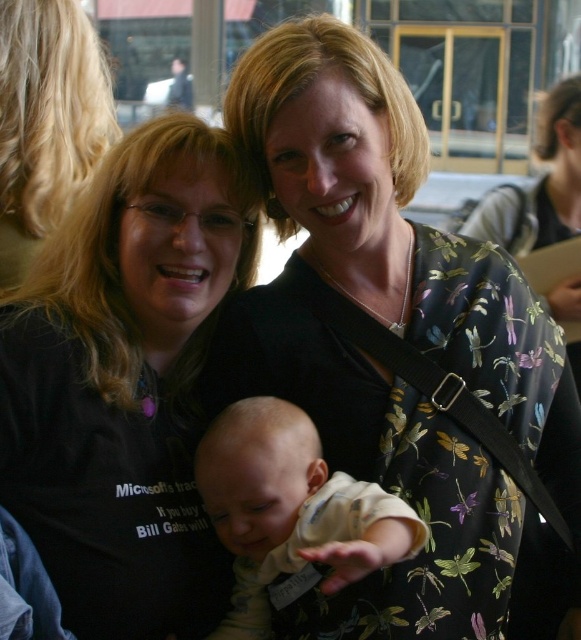
You are a photographer trying to capture a closeup of the baby while ensuring the text on the black matte shirt at left is still visible in the background. Is the light beige soft fabric baby at center positioned in a way that allows both elements to be in focus?

The light beige soft fabric baby at center is behind the black matte shirt at left, so the baby is closer to the camera than the shirt. This means the baby will be in focus, but the shirt might be slightly out of focus. To capture both clearly, adjust the focus to include both distances or use a smaller aperture for a deeper depth of field.

You are standing at a distance of 35 feet from the camera and want to reach the point marked as point (497, 442). Can you reach it without moving closer to the camera?

The distance of point (497, 442) from camera is 36.28 feet, so you are currently 35 feet away from the camera. Since the point is farther away than your current position, you would need to move 1.28 feet further away from the camera to reach it. Therefore, you cannot reach it without moving closer or further from the camera.